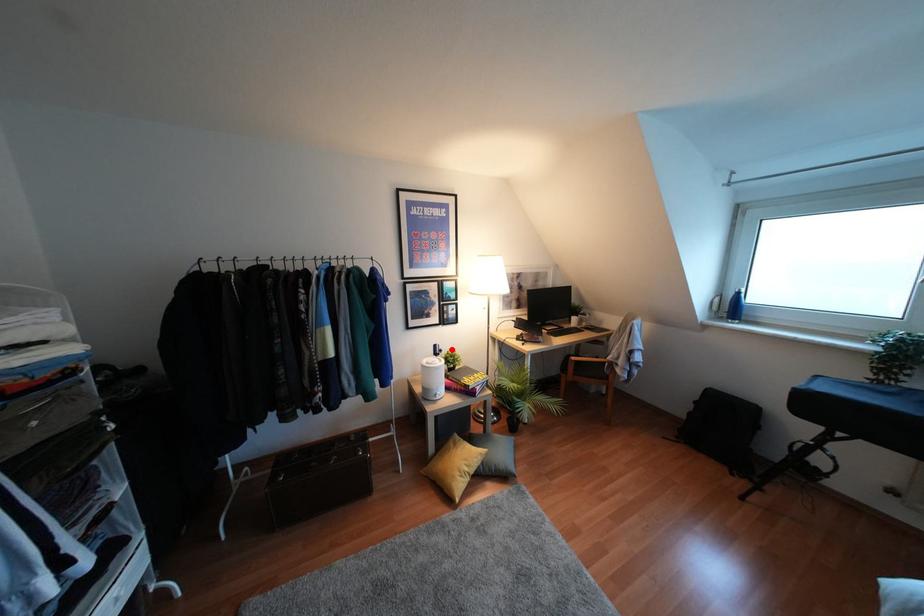
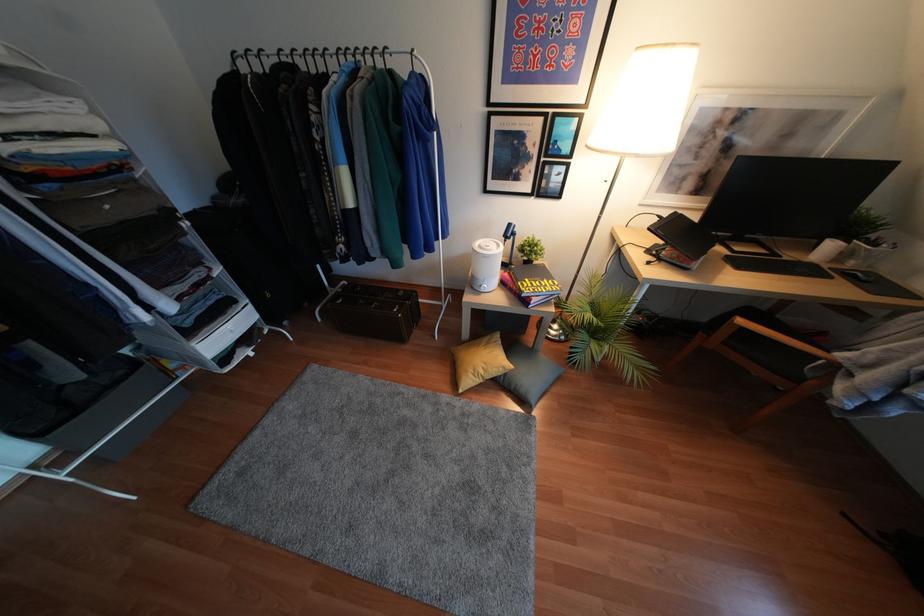
Find the pixel in the second image that matches the highlighted location in the first image.

(536, 237)